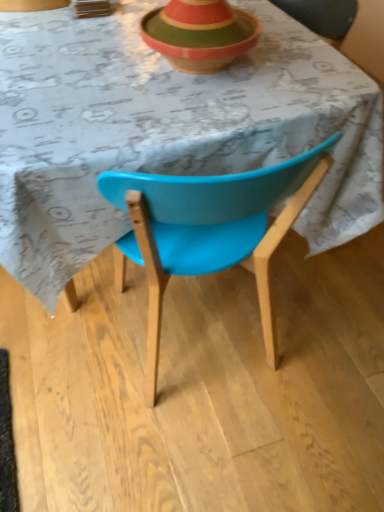
The width and height of the screenshot is (384, 512). In order to click on vacant space situated on the left part of wooden striped bowl at upper center in this screenshot , I will do `click(88, 59)`.